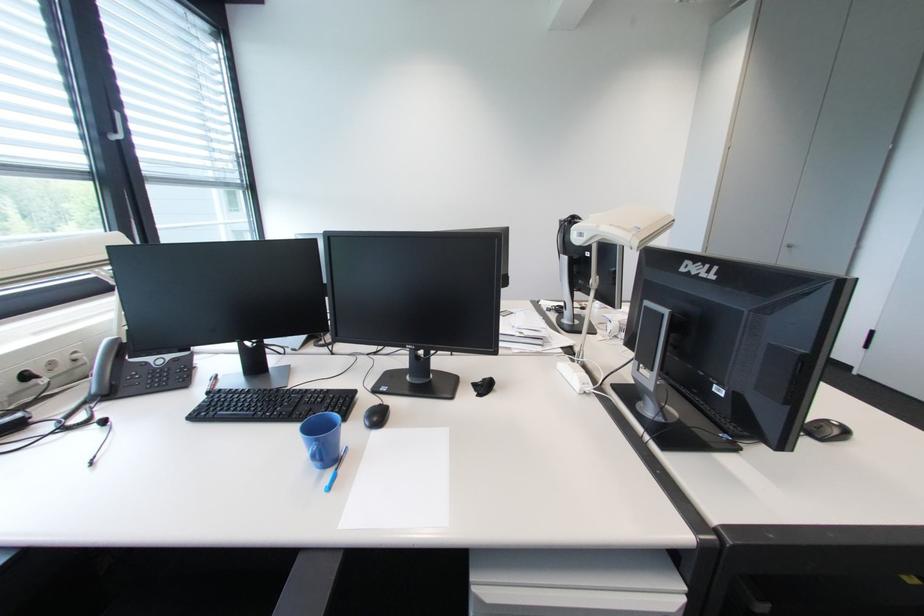
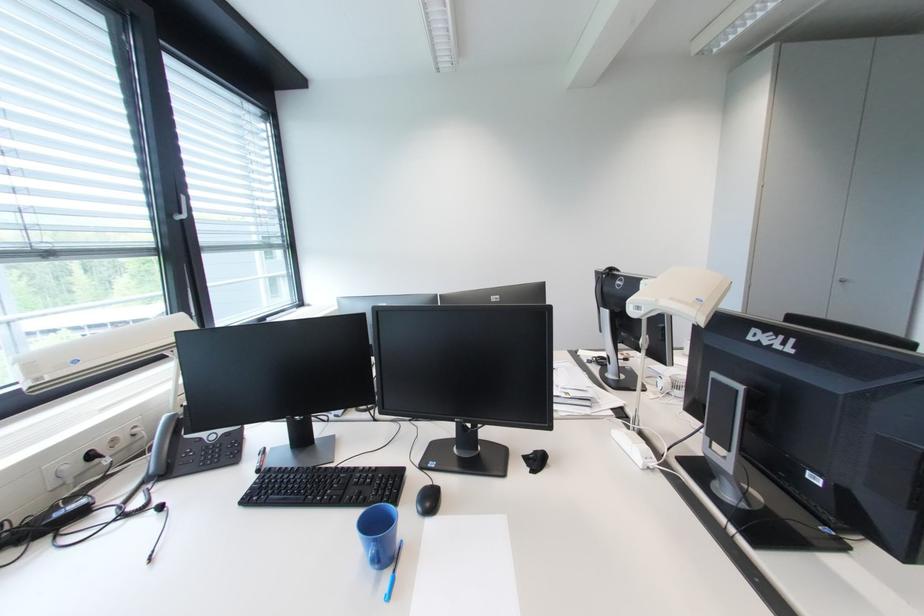
Where in the second image is the point corresponding to (x=792, y=249) from the first image?

(844, 285)